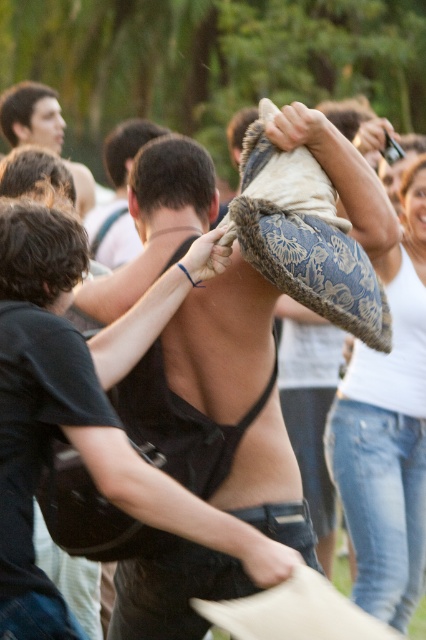
Which of these two, shiny black tank top at center or dark brown hair at upper left, stands taller?

shiny black tank top at center

Is shiny black tank top at center taller than dark brown hair at upper left?

Indeed, shiny black tank top at center has a greater height compared to dark brown hair at upper left.

You are a GUI agent. You are given a task and a screenshot of the screen. Output one action in this format:
    pyautogui.click(x=<x>, y=<y>)
    Task: Click on the shiny black tank top at center
    The height and width of the screenshot is (640, 426).
    Given the screenshot: What is the action you would take?
    pyautogui.click(x=118, y=195)

What are the coordinates of `shiny black tank top at center` in the screenshot? It's located at (118, 195).

Is black fabric bra at center above dark brown hair at upper left?

Incorrect, black fabric bra at center is not positioned above dark brown hair at upper left.

Does black fabric bra at center have a smaller size compared to dark brown hair at upper left?

Indeed, black fabric bra at center has a smaller size compared to dark brown hair at upper left.

Identify the location of black fabric bra at center. (86, 412).

Is point (368, 576) closer to viewer compared to point (22, 83)?

Yes.

Find the location of a particular element. The image size is (426, 640). blue patterned pillow at upper right is located at coordinates (388, 433).

You are a GUI agent. You are given a task and a screenshot of the screen. Output one action in this format:
    pyautogui.click(x=<x>, y=<y>)
    Task: Click on the blue patterned pillow at upper right
    The height and width of the screenshot is (640, 426).
    Given the screenshot: What is the action you would take?
    pyautogui.click(x=388, y=433)

This screenshot has height=640, width=426. I want to click on blue patterned pillow at upper right, so click(x=388, y=433).